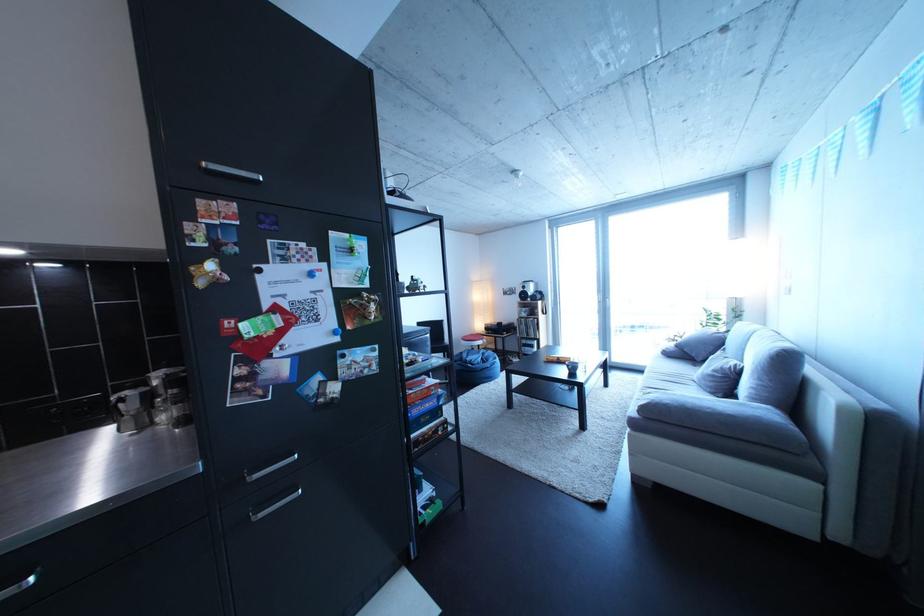
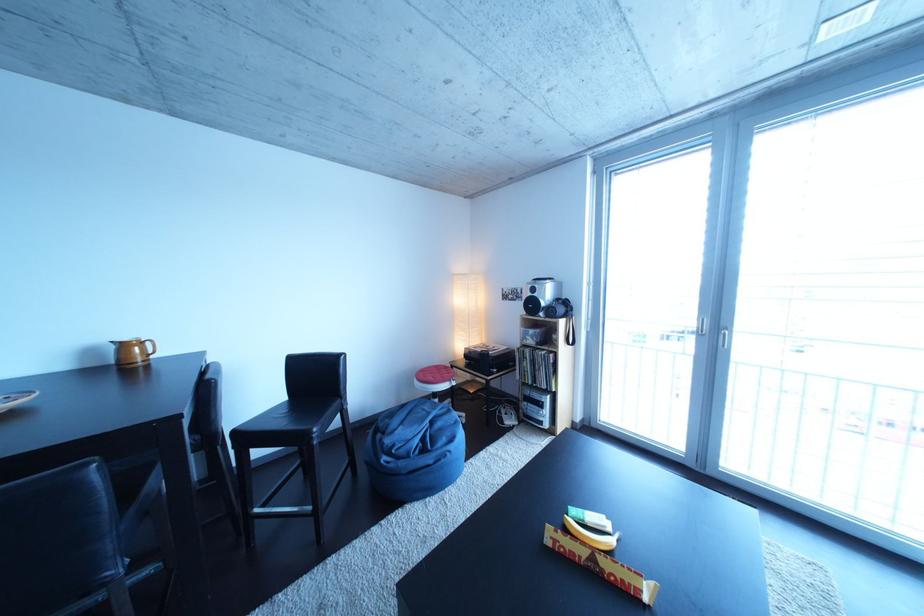
In the second image, find the point that corresponds to (622,304) in the first image.

(743, 334)